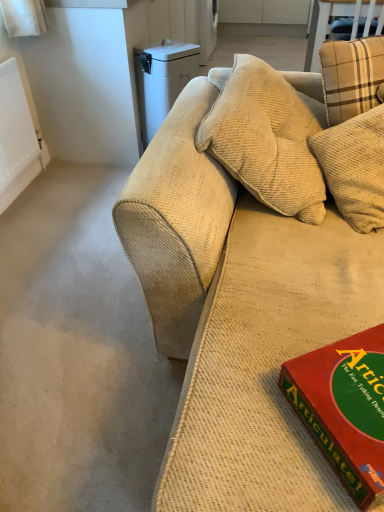
Where is `free point above red matte board game at lower right (from a real-world perspective)`? free point above red matte board game at lower right (from a real-world perspective) is located at coordinates (354, 393).